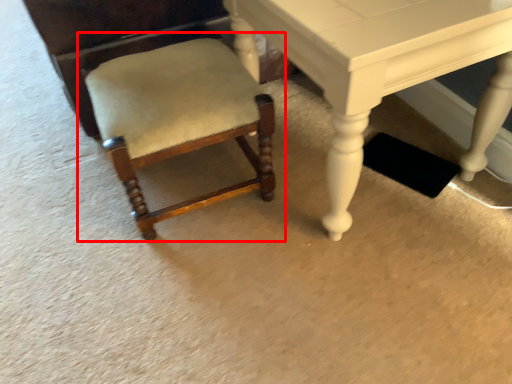
Question: Observing the image, what is the correct spatial positioning of chair (annotated by the red box) in reference to table?

Choices:
 (A) right
 (B) left

Answer: (B)